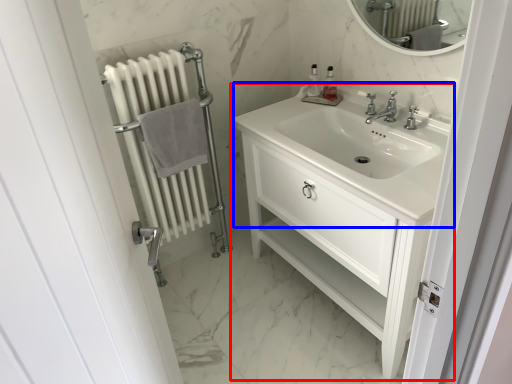
Question: Among these objects, which one is nearest to the camera, bathroom cabinet (highlighted by a red box) or sink (highlighted by a blue box)?

Choices:
 (A) bathroom cabinet
 (B) sink

Answer: (A)